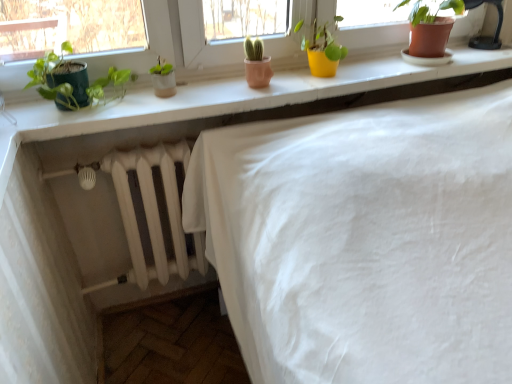
Question: Considering the relative positions of matte white windowsill at upper center and green matte pot at left, the 1th houseplant in the left-to-right sequence, in the image provided, is matte white windowsill at upper center to the left of green matte pot at left, the 1th houseplant in the left-to-right sequence, from the viewer's perspective?

Choices:
 (A) no
 (B) yes

Answer: (A)

Question: From a real-world perspective, is matte white windowsill at upper center below green matte pot at left, the 1th houseplant in the left-to-right sequence?

Choices:
 (A) yes
 (B) no

Answer: (A)

Question: From a real-world perspective, is matte white windowsill at upper center located higher than green matte pot at left, acting as the 3th houseplant starting from the right?

Choices:
 (A) yes
 (B) no

Answer: (B)

Question: Is matte white windowsill at upper center oriented towards green matte pot at left, the 1th houseplant in the left-to-right sequence?

Choices:
 (A) no
 (B) yes

Answer: (A)

Question: Can you confirm if matte white windowsill at upper center is taller than green matte pot at left, the 1th houseplant in the left-to-right sequence?

Choices:
 (A) yes
 (B) no

Answer: (B)

Question: From the image's perspective, is matte white windowsill at upper center located beneath green matte pot at left, acting as the 3th houseplant starting from the right?

Choices:
 (A) no
 (B) yes

Answer: (A)

Question: Is yellow matte pot at upper center, which is counted as the 2th houseplant, starting from the left, touching terracotta clay pot at upper right, arranged as the 3th houseplant when viewed from the left?

Choices:
 (A) no
 (B) yes

Answer: (A)

Question: Is yellow matte pot at upper center, which is counted as the 2th houseplant, starting from the left, positioned in front of terracotta clay pot at upper right, arranged as the 3th houseplant when viewed from the left?

Choices:
 (A) yes
 (B) no

Answer: (A)

Question: Can you confirm if yellow matte pot at upper center, which is counted as the 2th houseplant, starting from the left, is shorter than terracotta clay pot at upper right, which is the first houseplant in right-to-left order?

Choices:
 (A) no
 (B) yes

Answer: (B)

Question: Could terracotta clay pot at upper right, which is the first houseplant in right-to-left order, be considered to be inside yellow matte pot at upper center, which is counted as the 2th houseplant, starting from the left?

Choices:
 (A) no
 (B) yes

Answer: (A)

Question: From the image's perspective, is yellow matte pot at upper center, which is the second houseplant in right-to-left order, over terracotta clay pot at upper right, which is the first houseplant in right-to-left order?

Choices:
 (A) yes
 (B) no

Answer: (B)

Question: Does yellow matte pot at upper center, which is the second houseplant in right-to-left order, have a smaller size compared to terracotta clay pot at upper right, arranged as the 3th houseplant when viewed from the left?

Choices:
 (A) no
 (B) yes

Answer: (B)

Question: Can you confirm if green matte pot at left, acting as the 3th houseplant starting from the right, is wider than yellow matte pot at upper center, which is counted as the 2th houseplant, starting from the left?

Choices:
 (A) no
 (B) yes

Answer: (B)